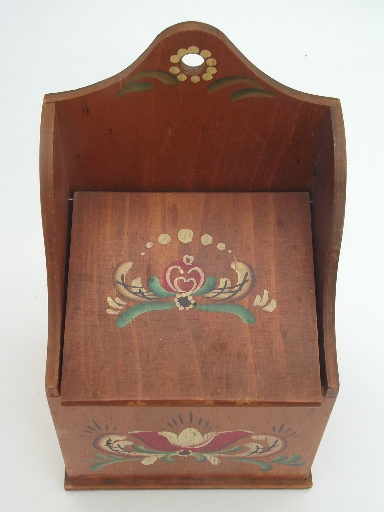
This screenshot has width=384, height=512. I want to click on lid of box, so click(182, 362).